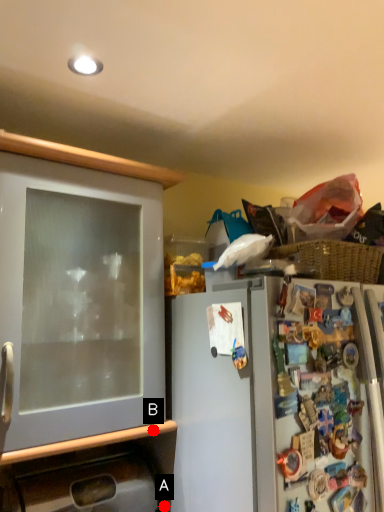
Question: Two points are circled on the image, labeled by A and B beside each circle. Which point appears farthest from the camera in this image?

Choices:
 (A) A is further
 (B) B is further

Answer: (A)